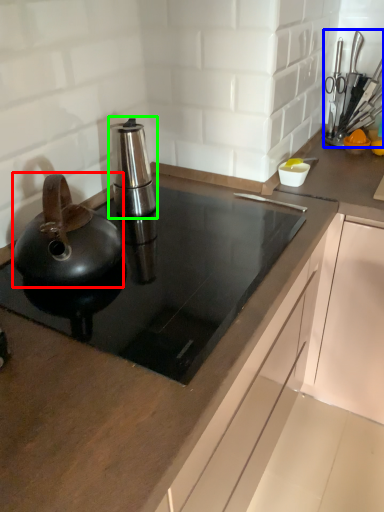
Question: Based on their relative distances, which object is nearer to kitchen appliance (highlighted by a red box)? Choose from appliance (highlighted by a blue box) and kitchen appliance (highlighted by a green box).

Choices:
 (A) appliance
 (B) kitchen appliance

Answer: (B)